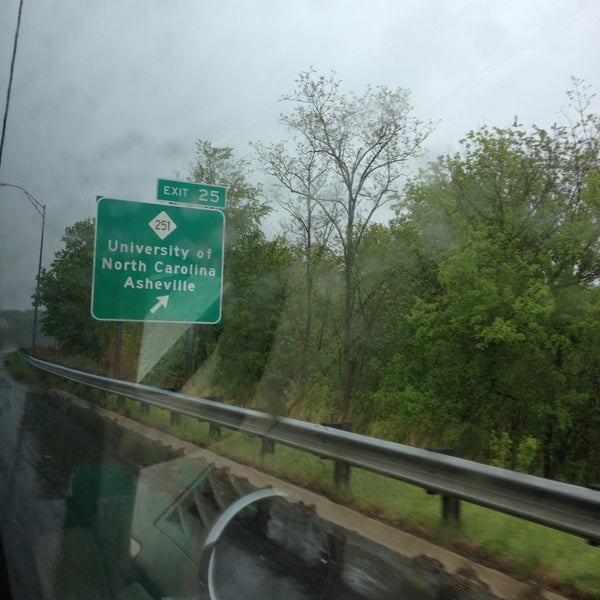
Locate an element on the screen. directional arrow on exit sign is located at coordinates (159, 303).